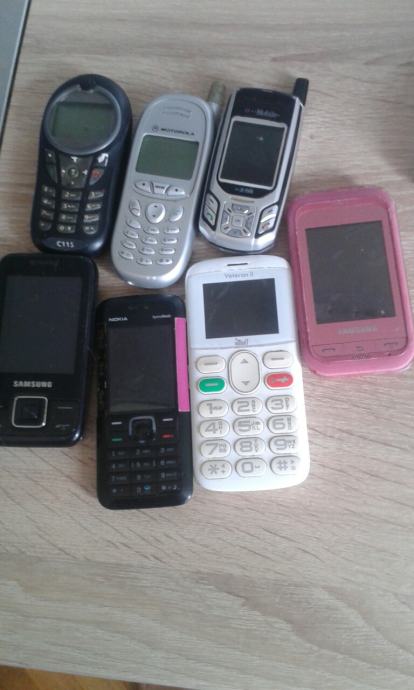
This screenshot has height=690, width=414. Find the location of `key pads`. key pads is located at coordinates (66, 201), (154, 228), (231, 431), (143, 450).